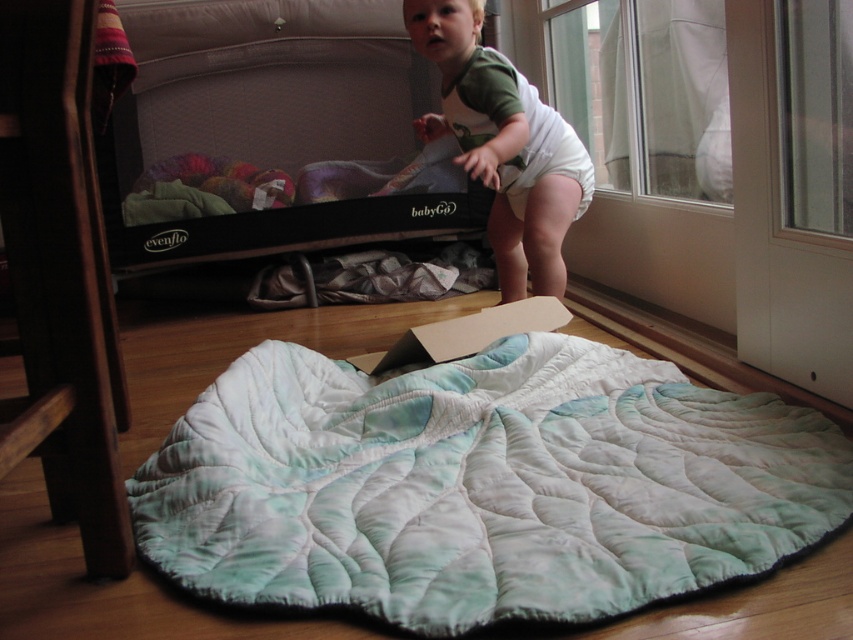
Does quilted fabric at lower center have a smaller size compared to black fabric playpen at upper center?

Yes.

Does quilted fabric at lower center have a larger size compared to black fabric playpen at upper center?

Actually, quilted fabric at lower center might be smaller than black fabric playpen at upper center.

Image resolution: width=853 pixels, height=640 pixels. In order to click on quilted fabric at lower center in this screenshot , I will do (x=480, y=484).

At what (x,y) coordinates should I click in order to perform the action: click on quilted fabric at lower center. Please return your answer as a coordinate pair (x, y). The image size is (853, 640). Looking at the image, I should click on (480, 484).

Does point (367, 13) come in front of point (514, 138)?

No, (367, 13) is behind (514, 138).

Between point (387, 100) and point (585, 156), which one is positioned behind?

Positioned behind is point (387, 100).

This screenshot has height=640, width=853. Identify the location of black fabric playpen at upper center. (273, 131).

Between quilted fabric at lower center and white cloth diaper at upper center, which one has more height?

white cloth diaper at upper center is taller.

Where is `quilted fabric at lower center`? Image resolution: width=853 pixels, height=640 pixels. quilted fabric at lower center is located at coordinates (480, 484).